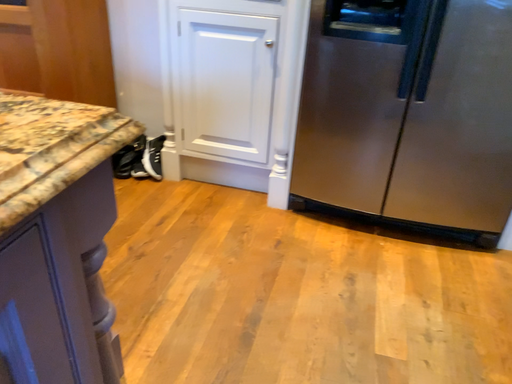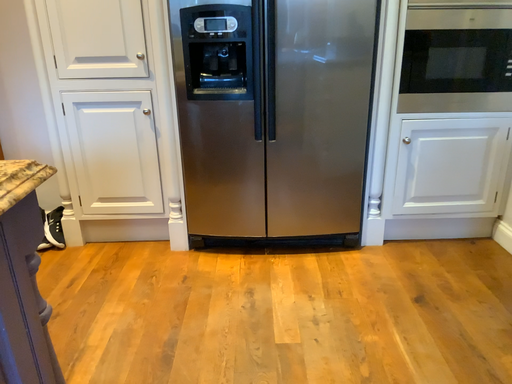
Question: Which way did the camera rotate in the video?

Choices:
 (A) rotated left
 (B) rotated right

Answer: (B)